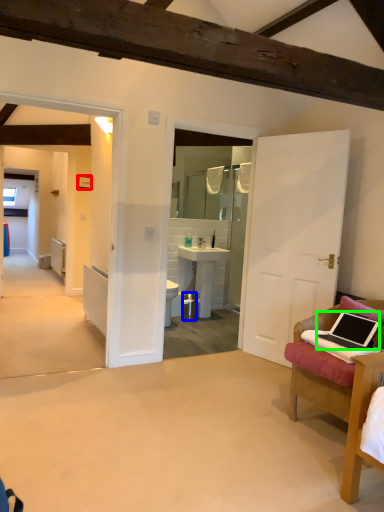
Question: Which object is positioned farthest from picture frame (highlighted by a red box)? Select from trash bin/can (highlighted by a blue box) and laptop (highlighted by a green box).

Choices:
 (A) trash bin/can
 (B) laptop

Answer: (B)